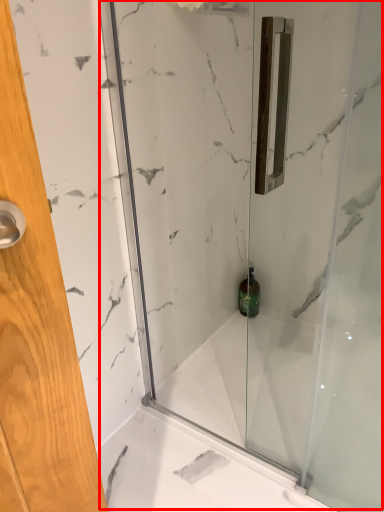
Question: From the image's perspective, where is shower door (annotated by the red box) located in relation to toiletry in the image?

Choices:
 (A) below
 (B) above

Answer: (B)